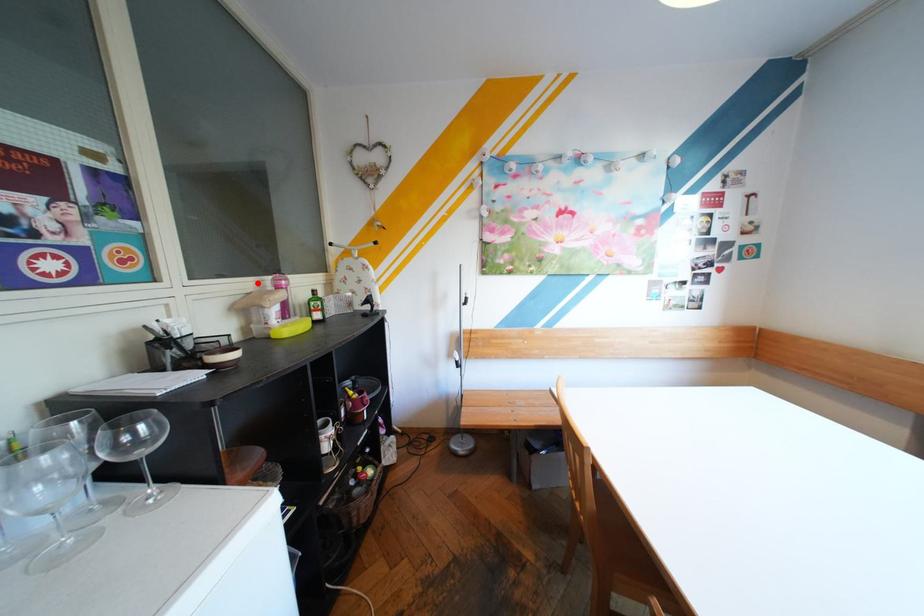
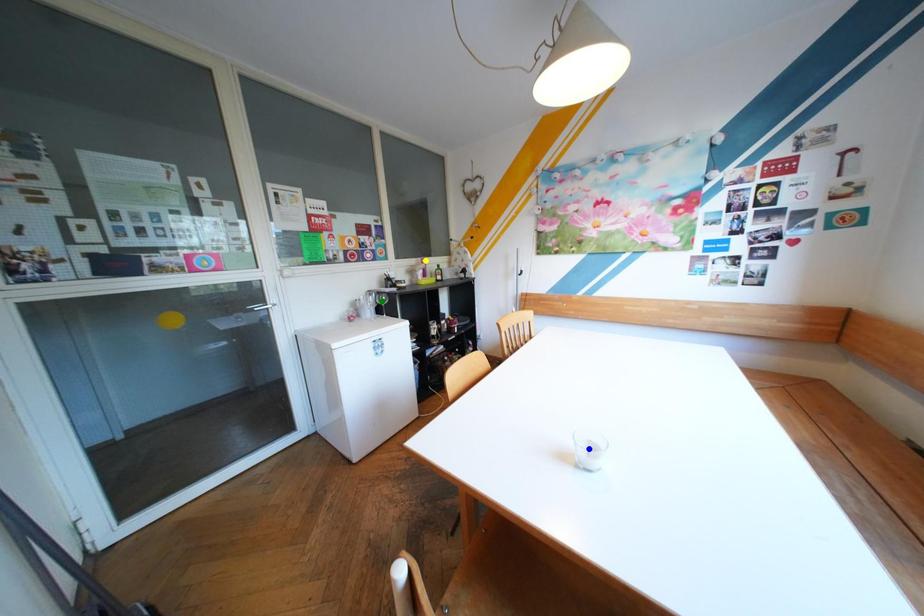
Question: I am providing you with two images of the same scene from different viewpoints. A red point is marked on the first image. You are given multiple points on the second image. Which mark in image 2 goes with the point in image 1?

Choices:
 (A) green point
 (B) blue point
 (C) yellow point

Answer: (C)